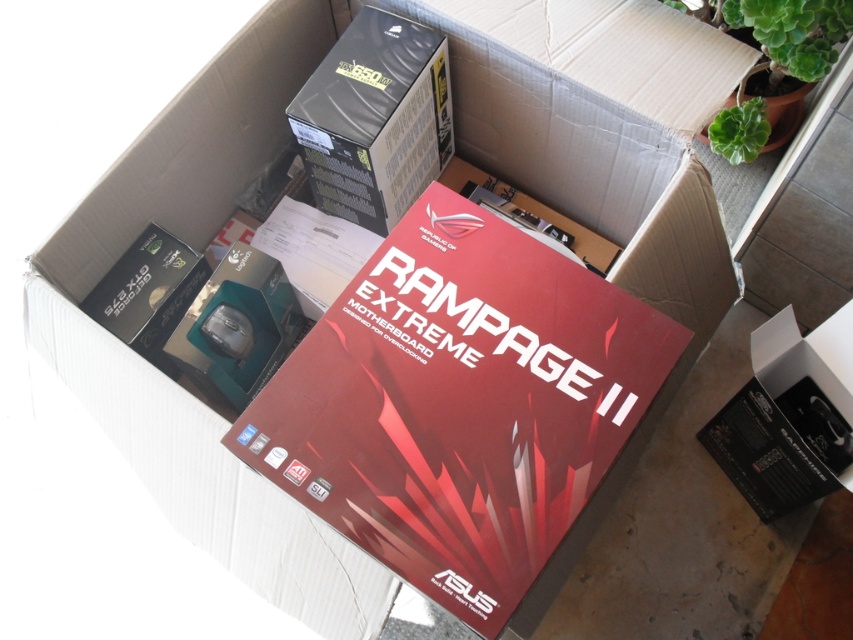
Question: Among these objects, which one is nearest to the camera?

Choices:
 (A) black matte power supply at upper center
 (B) black plastic box at lower right
 (C) red matte motherboard at center

Answer: (C)

Question: Does red matte motherboard at center appear over black matte power supply at upper center?

Choices:
 (A) no
 (B) yes

Answer: (A)

Question: Which of the following is the farthest from the observer?

Choices:
 (A) (486, 225)
 (B) (775, 323)

Answer: (B)

Question: Which point is closer to the camera taking this photo?

Choices:
 (A) (834, 358)
 (B) (579, 310)

Answer: (B)

Question: Can you confirm if red matte motherboard at center is wider than black plastic box at lower right?

Choices:
 (A) no
 (B) yes

Answer: (B)

Question: Is red matte motherboard at center smaller than black matte power supply at upper center?

Choices:
 (A) yes
 (B) no

Answer: (B)